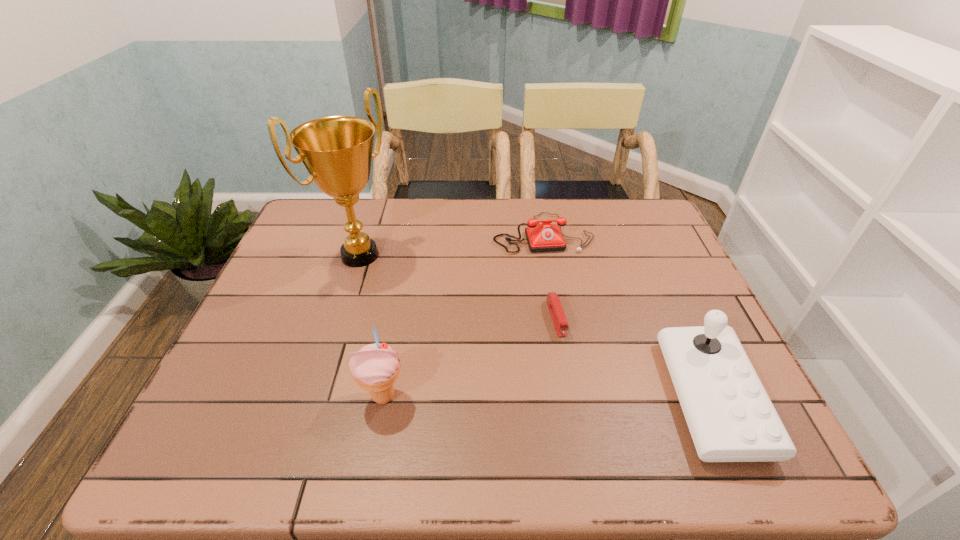
I want to click on vacant region located on the front view with handles of the tallest object, so click(x=409, y=293).

Locate an element on the screen. free region located on the dial of the fourth tallest object is located at coordinates (555, 271).

The image size is (960, 540). Identify the location of vacant area situated 0.090m on the dial of the fourth tallest object. 557,275.

In order to click on vacant space located 0.260m on the dial of the fourth tallest object in this screenshot , I will do click(x=571, y=321).

The image size is (960, 540). What are the coordinates of `vacant region located on the front-facing side of the shortest object` in the screenshot? It's located at (585, 408).

At what (x,y) coordinates should I click in order to perform the action: click on free space located 0.200m on the front-facing side of the shortest object. Please return your answer as a coordinate pair (x, y). Looking at the image, I should click on (586, 413).

The width and height of the screenshot is (960, 540). I want to click on vacant space located 0.140m on the front-facing side of the shortest object, so click(x=577, y=388).

The image size is (960, 540). Identify the location of award that is at the far edge. (337, 151).

Find the location of `telephone that is at the far edge`. telephone that is at the far edge is located at coordinates (545, 237).

This screenshot has height=540, width=960. What are the coordinates of `icecream at the near edge` in the screenshot? It's located at (375, 367).